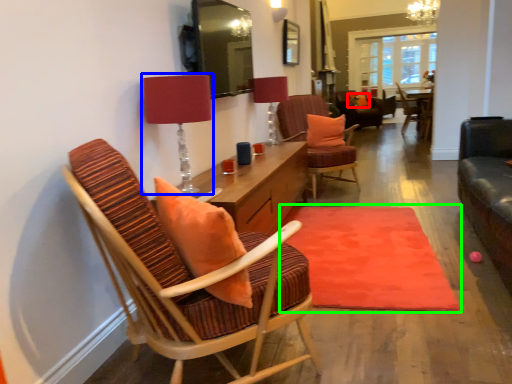
Question: Estimate the real-world distances between objects in this image. Which object is farther from pillow (highlighted by a red box), table lamp (highlighted by a blue box) or mat (highlighted by a green box)?

Choices:
 (A) table lamp
 (B) mat

Answer: (A)